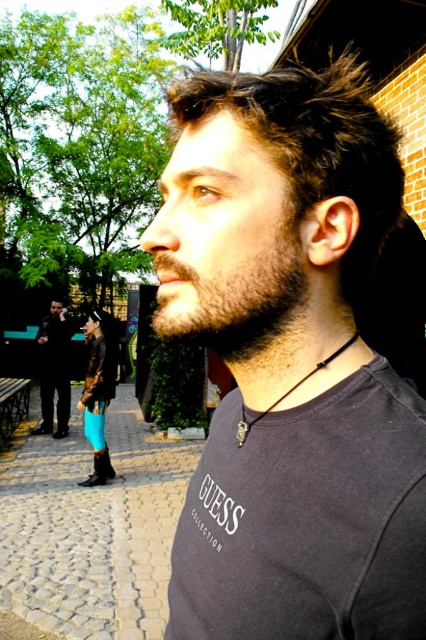
Question: Which object is the farthest from the matte black shirt at center?

Choices:
 (A) dark gray fleece sweatshirt at lower left
 (B) black leather jacket at left

Answer: (B)

Question: Observing the image, what is the correct spatial positioning of matte black shirt at center in reference to dark gray fleece sweatshirt at lower left?

Choices:
 (A) below
 (B) above

Answer: (B)

Question: Which of the following is the farthest from the observer?

Choices:
 (A) (92, 394)
 (B) (374, 161)

Answer: (A)

Question: Is matte black shirt at center wider than black leather jacket at left?

Choices:
 (A) yes
 (B) no

Answer: (B)

Question: Which object is the closest to the dark gray fleece sweatshirt at lower left?

Choices:
 (A) black leather jacket at left
 (B) matte black shirt at center

Answer: (A)

Question: Is matte black shirt at center to the right of black leather jacket at left from the viewer's perspective?

Choices:
 (A) yes
 (B) no

Answer: (A)